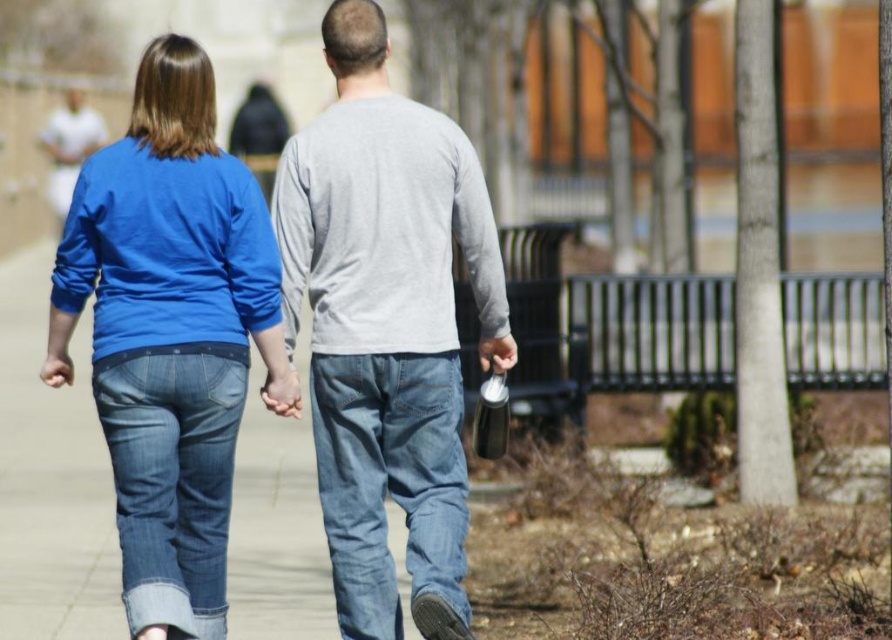
Question: Which point is closer to the camera?

Choices:
 (A) gray cotton shirt at center
 (B) matte blue jeans at left

Answer: (B)

Question: Can you confirm if gray matte shirt at center is thinner than denim jeans at center?

Choices:
 (A) no
 (B) yes

Answer: (A)

Question: Can you confirm if matte blue jeans at left is wider than denim jeans at center?

Choices:
 (A) no
 (B) yes

Answer: (B)

Question: Which of these objects is positioned closest to the gray cotton shirt at center?

Choices:
 (A) matte blue jeans at left
 (B) gray matte shirt at center

Answer: (B)

Question: Does gray cotton shirt at center have a greater width compared to denim jeans at lower left?

Choices:
 (A) no
 (B) yes

Answer: (B)

Question: Which object appears closest to the camera in this image?

Choices:
 (A) denim jeans at lower left
 (B) matte blue jeans at left
 (C) gray matte shirt at center

Answer: (A)